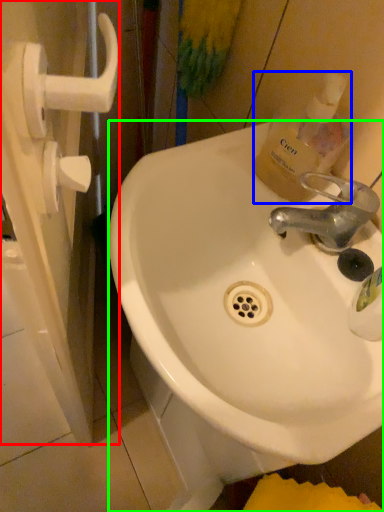
Question: Considering the real-world distances, which object is farthest from screen door (highlighted by a red box)? bottle (highlighted by a blue box) or sink (highlighted by a green box)?

Choices:
 (A) bottle
 (B) sink

Answer: (A)